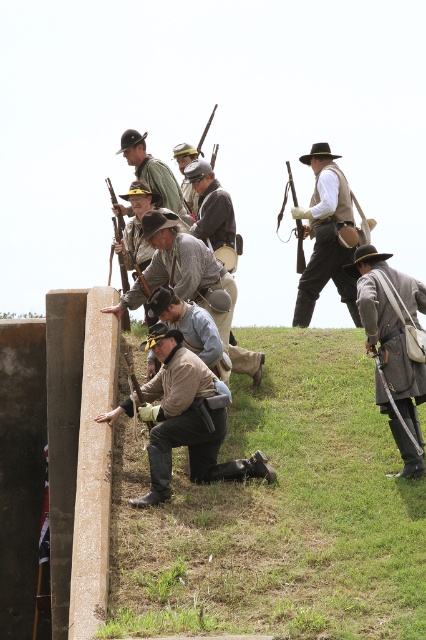
Question: Which point is closer to the camera?

Choices:
 (A) wooden rifle at upper left
 (B) matte brown leather hat at upper center
 (C) brown leather hat at center
 (D) wooden rifle at center

Answer: (C)

Question: In this image, where is brown leather boots at lower center located relative to matte brown leather hat at upper center?

Choices:
 (A) above
 (B) below

Answer: (B)

Question: Among these objects, which one is farthest from the camera?

Choices:
 (A) brown leather pants at lower center
 (B) wooden rifle at upper left

Answer: (B)

Question: Can you confirm if matte brown leather hat at upper center is positioned above wooden rifle at upper left?

Choices:
 (A) no
 (B) yes

Answer: (B)

Question: Estimate the real-world distances between objects in this image. Which object is closer to the gray wool coat at lower right?

Choices:
 (A) brown leather boots at lower center
 (B) brown leather pants at lower center

Answer: (B)

Question: Is green grass at lower center below wooden rifle at upper left?

Choices:
 (A) yes
 (B) no

Answer: (A)